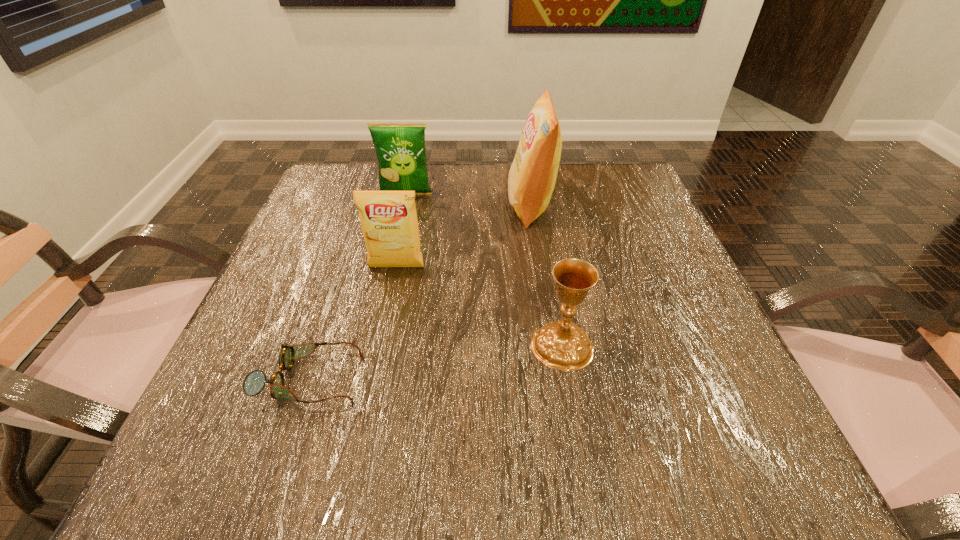
Where is `the tallest object`? The width and height of the screenshot is (960, 540). the tallest object is located at coordinates (531, 180).

In order to click on the tallest crisp (potato chip) in this screenshot , I will do `click(531, 180)`.

Image resolution: width=960 pixels, height=540 pixels. I want to click on the nearest crisp (potato chip), so click(389, 222).

Where is `chalice`? The height and width of the screenshot is (540, 960). chalice is located at coordinates (563, 345).

You are a GUI agent. You are given a task and a screenshot of the screen. Output one action in this format:
    pyautogui.click(x=<x>, y=<y>)
    Task: Click on the spectacles
    This screenshot has height=540, width=960.
    Given the screenshot: What is the action you would take?
    pyautogui.click(x=254, y=382)

Find the location of a particular element. blank area located on the front-facing side of the tallest crisp (potato chip) is located at coordinates (399, 206).

At what (x,y) coordinates should I click in order to perform the action: click on free point located on the front-facing side of the tallest crisp (potato chip). Please return your answer as a coordinate pair (x, y). This screenshot has height=540, width=960. Looking at the image, I should click on (460, 206).

Identify the location of free location located on the front-facing side of the tallest crisp (potato chip). (477, 206).

Locate an element on the screen. Image resolution: width=960 pixels, height=540 pixels. free space located on the front of the third nearest object with the logo is located at coordinates (363, 428).

Locate an element on the screen. The width and height of the screenshot is (960, 540). vacant region located on the left of the chalice is located at coordinates (330, 345).